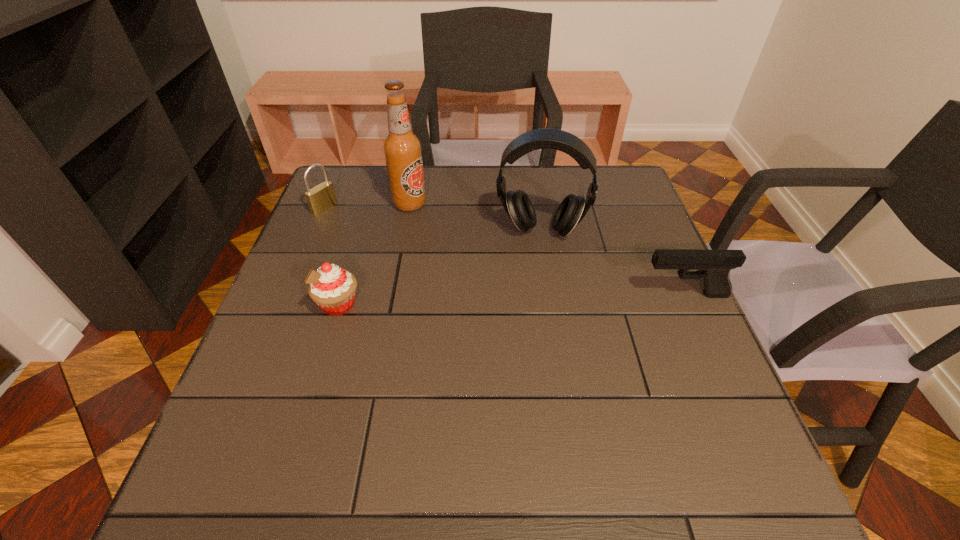
In order to click on beer bottle located at the far edge in this screenshot , I will do pyautogui.click(x=402, y=148).

The image size is (960, 540). I want to click on padlock positioned at the far edge, so click(x=322, y=197).

Identify the location of cupcake situated at the left edge. This screenshot has height=540, width=960. (331, 287).

Where is `padlock situated at the left edge`? This screenshot has width=960, height=540. padlock situated at the left edge is located at coordinates (322, 197).

Locate an element on the screen. The width and height of the screenshot is (960, 540). object that is at the right edge is located at coordinates (714, 266).

Identify the location of object that is at the far left corner. The height and width of the screenshot is (540, 960). (322, 197).

The height and width of the screenshot is (540, 960). I want to click on blank space at the far edge of the desktop, so click(x=434, y=197).

This screenshot has height=540, width=960. I want to click on free space at the near edge of the desktop, so click(x=514, y=402).

In the image, there is a desktop. At what (x,y) coordinates should I click in order to perform the action: click on free space at the left edge. Please return your answer as a coordinate pair (x, y). Looking at the image, I should click on (303, 306).

Locate an element on the screen. vacant region at the right edge of the desktop is located at coordinates (612, 255).